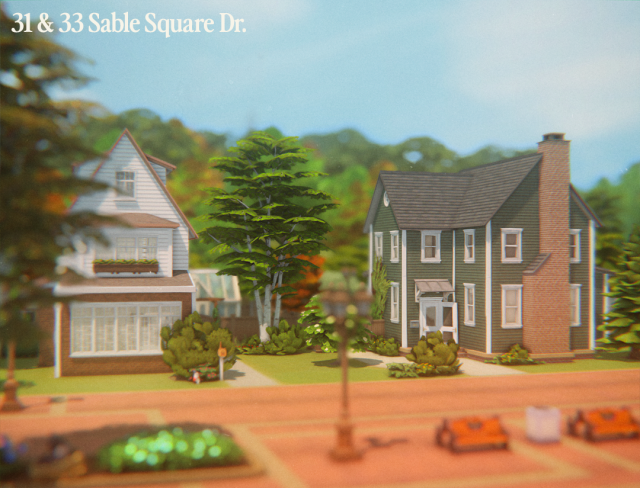
The image size is (640, 488). I want to click on benches, so click(475, 429), click(616, 427).